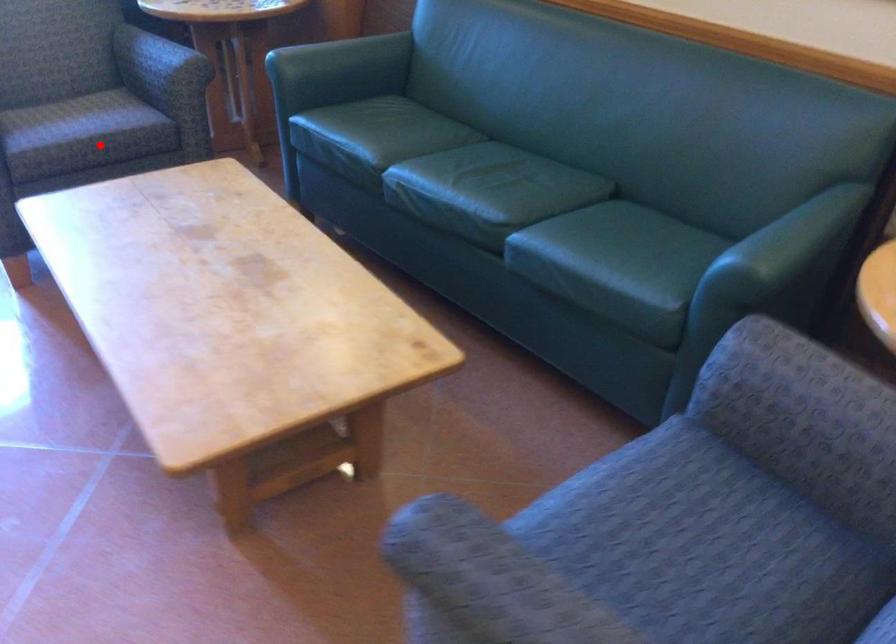
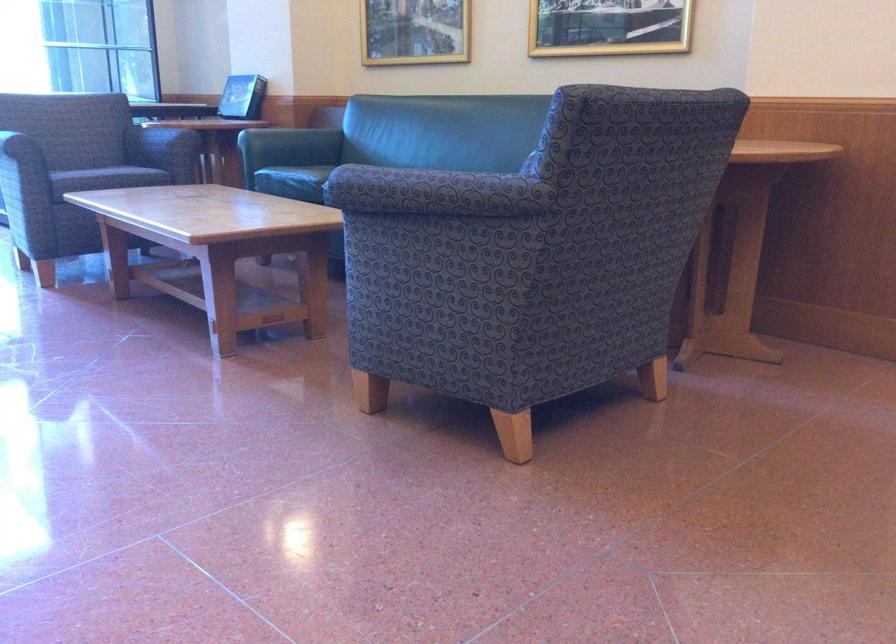
Question: I am providing you with two images of the same scene from different viewpoints. Given a red point in image1, look at the same physical point in image2. Is it:

Choices:
 (A) Closer to the viewpoint
 (B) Farther from the viewpoint

Answer: (B)